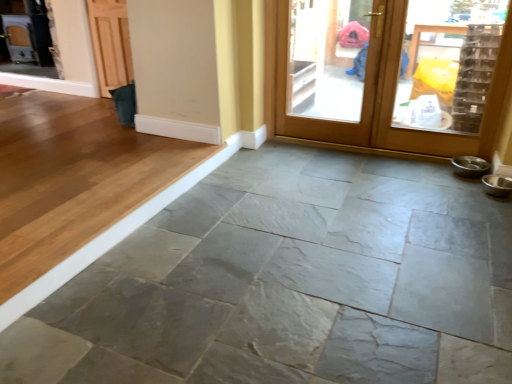
The height and width of the screenshot is (384, 512). What do you see at coordinates (289, 283) in the screenshot? I see `gray stone floor at center` at bounding box center [289, 283].

At what (x,y) coordinates should I click in order to perform the action: click on gray stone floor at center. Please return your answer as a coordinate pair (x, y). This screenshot has height=384, width=512. Looking at the image, I should click on (289, 283).

What is the approximate width of wooden door at upper right?

wooden door at upper right is 2.23 inches in width.

Locate an element on the screen. This screenshot has height=384, width=512. gray stone floor at center is located at coordinates (289, 283).

The height and width of the screenshot is (384, 512). I want to click on concrete on the left of wooden screen door at upper right, so click(289, 283).

From the picture: Between gray stone floor at center and wooden screen door at upper right, which one has more height?

Standing taller between the two is wooden screen door at upper right.

Between gray stone floor at center and wooden screen door at upper right, which one has larger size?

With larger size is gray stone floor at center.

From the image's perspective, which one is positioned lower, gray stone floor at center or wooden screen door at upper right?

gray stone floor at center, from the image's perspective.

From a real-world perspective, is wooden screen door at upper right above or below gray stone floor at center?

In terms of real-world spatial position, wooden screen door at upper right is above gray stone floor at center.

You are a GUI agent. You are given a task and a screenshot of the screen. Output one action in this format:
    pyautogui.click(x=<x>, y=<y>)
    Task: Click on the concrete on the left of wooden screen door at upper right
    This screenshot has height=384, width=512.
    Given the screenshot: What is the action you would take?
    (x=289, y=283)

Is wooden screen door at upper right positioned far away from gray stone floor at center?

Result: That's right, there is a large distance between wooden screen door at upper right and gray stone floor at center.

Is wooden screen door at upper right spatially inside gray stone floor at center, or outside of it?

wooden screen door at upper right exists outside the volume of gray stone floor at center.

Consider the image. Is wooden screen door at upper right in contact with wooden door at upper right?

No, wooden screen door at upper right is not with wooden door at upper right.

Does point (358, 91) come closer to viewer compared to point (324, 141)?

No, (358, 91) is further to viewer.

How many degrees apart are the facing directions of wooden screen door at upper right and wooden door at upper right?

wooden screen door at upper right and wooden door at upper right are facing 0.00108 degrees away from each other.

Locate an element on the screen. The width and height of the screenshot is (512, 384). door in front of the wooden screen door at upper right is located at coordinates (394, 73).

Is wooden door at upper right touching wooden screen door at upper right?

No.

Is wooden door at upper right aimed at wooden screen door at upper right?

Yes, wooden door at upper right faces towards wooden screen door at upper right.

From the picture: Measure the distance between wooden door at upper right and wooden screen door at upper right.

A distance of 37.79 inches exists between wooden door at upper right and wooden screen door at upper right.

From a real-world perspective, relative to wooden door at upper right, is gray stone floor at center vertically above or below?

Result: Clearly, from a real-world perspective, gray stone floor at center is below wooden door at upper right.

Between gray stone floor at center and wooden door at upper right, which one has more height?

With more height is wooden door at upper right.

How far apart are gray stone floor at center and wooden door at upper right?

The distance of gray stone floor at center from wooden door at upper right is 4.75 feet.

From the image's perspective, is gray stone floor at center positioned above or below wooden door at upper right?

Clearly, from the image's perspective, gray stone floor at center is below wooden door at upper right.

Would you say gray stone floor at center is part of wooden door at upper right's contents?

No, wooden door at upper right does not contain gray stone floor at center.

Considering the relative sizes of wooden door at upper right and gray stone floor at center in the image provided, is wooden door at upper right shorter than gray stone floor at center?

Incorrect, the height of wooden door at upper right does not fall short of that of gray stone floor at center.

Considering the sizes of objects wooden door at upper right and gray stone floor at center in the image provided, who is bigger, wooden door at upper right or gray stone floor at center?

gray stone floor at center is bigger.

The image size is (512, 384). I want to click on screen door lying on the right of gray stone floor at center, so click(327, 68).

There is a gray stone floor at center. Identify the location of screen door above it (from a real-world perspective). This screenshot has width=512, height=384. (327, 68).

Which object lies nearer to the anchor point wooden door at upper right, gray stone floor at center or wooden screen door at upper right?

Among the two, wooden screen door at upper right is located nearer to wooden door at upper right.

Estimate the real-world distances between objects in this image. Which object is closer to wooden door at upper right, wooden screen door at upper right or gray stone floor at center?

wooden screen door at upper right is closer to wooden door at upper right.

When comparing their distances from gray stone floor at center, does wooden door at upper right or wooden screen door at upper right seem closer?

The object closer to gray stone floor at center is wooden door at upper right.

Looking at the image, which one is located closer to wooden screen door at upper right, gray stone floor at center or wooden door at upper right?

Based on the image, wooden door at upper right appears to be nearer to wooden screen door at upper right.

Looking at the image, which one is located further to wooden screen door at upper right, wooden door at upper right or gray stone floor at center?

gray stone floor at center.

Estimate the real-world distances between objects in this image. Which object is closer to gray stone floor at center, wooden screen door at upper right or wooden door at upper right?

wooden door at upper right is closer to gray stone floor at center.

Where is `door located between gray stone floor at center and wooden screen door at upper right in the depth direction`? door located between gray stone floor at center and wooden screen door at upper right in the depth direction is located at coordinates (394, 73).